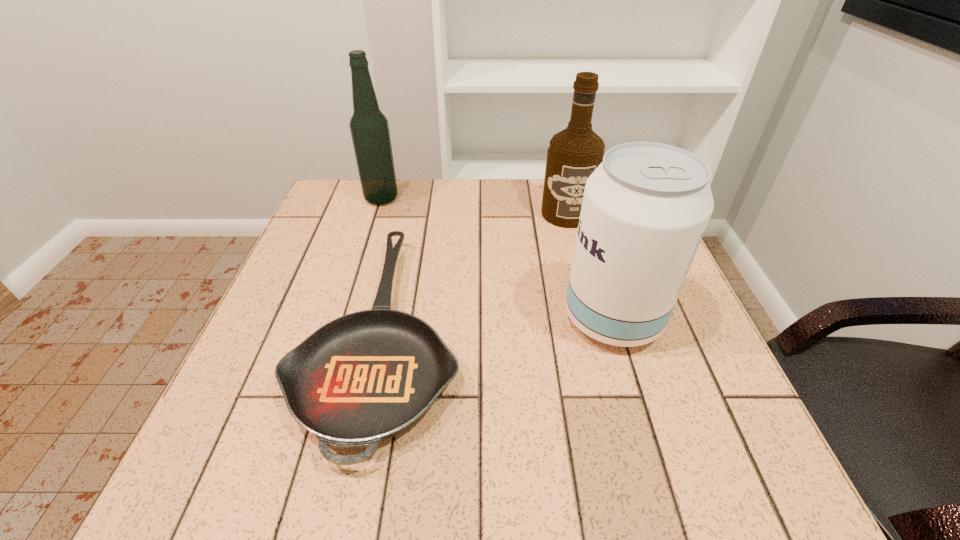
Locate an element on the screen. object at the near left corner is located at coordinates (367, 376).

Find the location of a particular element. The image size is (960, 540). object that is at the far right corner is located at coordinates (574, 153).

Where is `free space at the far edge of the desktop`? Image resolution: width=960 pixels, height=540 pixels. free space at the far edge of the desktop is located at coordinates 378,211.

At what (x,y) coordinates should I click in order to perform the action: click on free space at the near edge of the desktop. Please return your answer as a coordinate pair (x, y). Looking at the image, I should click on (581, 492).

Identify the location of vacant area at the left edge of the desktop. (294, 279).

Find the location of a particular element. Image resolution: width=960 pixels, height=540 pixels. vacant space at the right edge is located at coordinates (705, 399).

At what (x,y) coordinates should I click in order to perform the action: click on vacant space at the far left corner of the desktop. Please return your answer as a coordinate pair (x, y). Image resolution: width=960 pixels, height=540 pixels. Looking at the image, I should click on (360, 223).

Locate an element on the screen. vacant region at the near right corner of the desktop is located at coordinates (768, 465).

Image resolution: width=960 pixels, height=540 pixels. I want to click on unoccupied position between the frying pan and the leftmost alcohol, so click(x=382, y=266).

You are a GUI agent. You are given a task and a screenshot of the screen. Output one action in this format:
    pyautogui.click(x=<x>, y=<y>)
    Task: Click on the vacant area that lies between the frying pan and the leftmost alcohol
    The height and width of the screenshot is (540, 960).
    Given the screenshot: What is the action you would take?
    pyautogui.click(x=382, y=266)